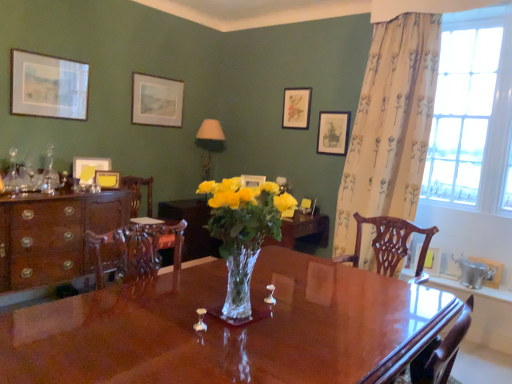
This screenshot has height=384, width=512. Identify the location of vacant region to the right of clear glass vase at center. (320, 304).